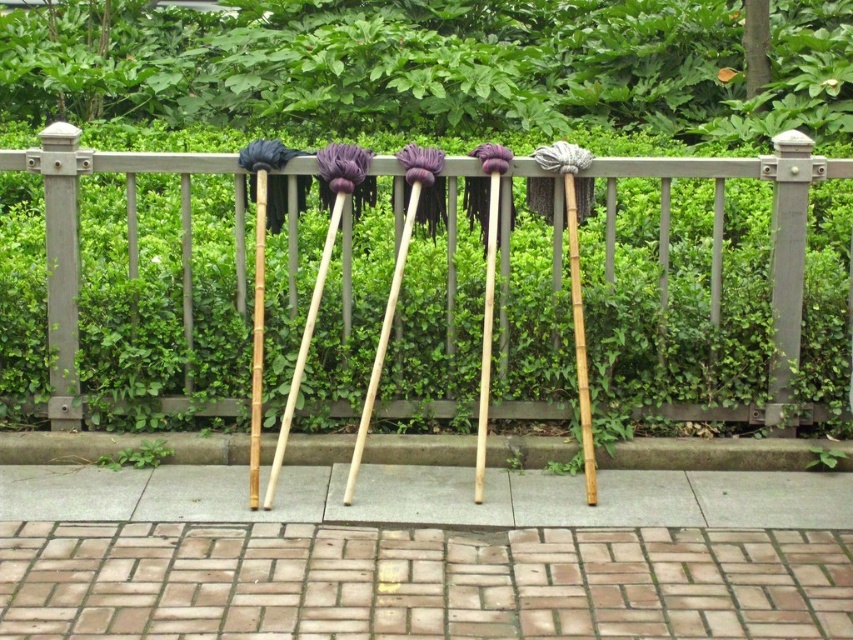
You are standing in a garden and see the wooden fence at center and the green leafy hedge at upper center. Which object is positioned to the right side of the other?

The wooden fence at center is to the right of the green leafy hedge at upper center.

You are standing in a garden and see the wooden fence at center and the brick paving at lower center. Which object takes up more space in the image?

The wooden fence at center is larger in size than the brick paving at lower center, so it takes up more space in the image.